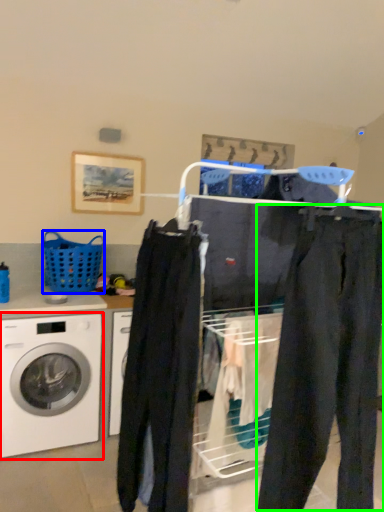
Question: Which object is the farthest from washing machine (highlighted by a red box)? Choose among these: basket (highlighted by a blue box) or pants (highlighted by a green box).

Choices:
 (A) basket
 (B) pants

Answer: (B)